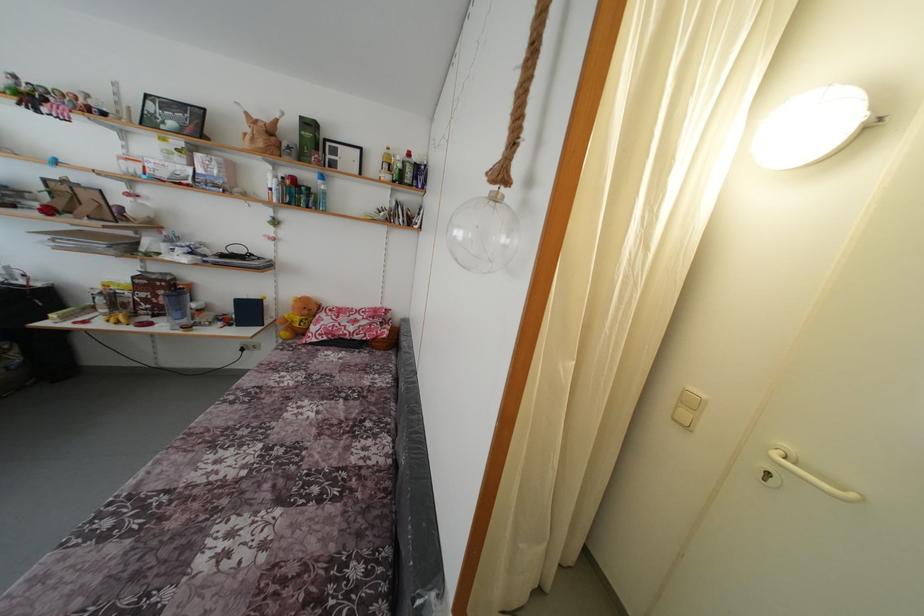
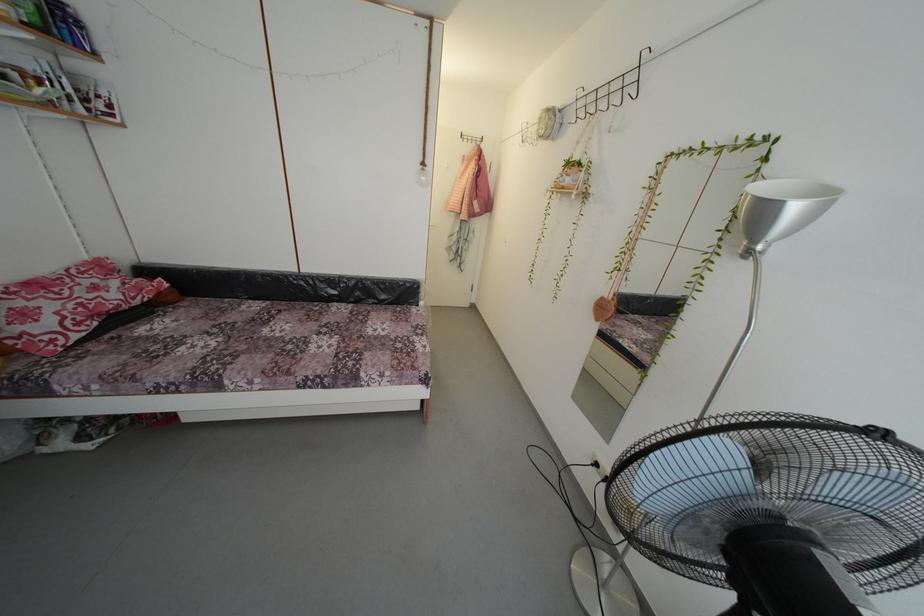
Locate, in the second image, the point that corresponds to pixel 297 390 in the first image.

(225, 345)